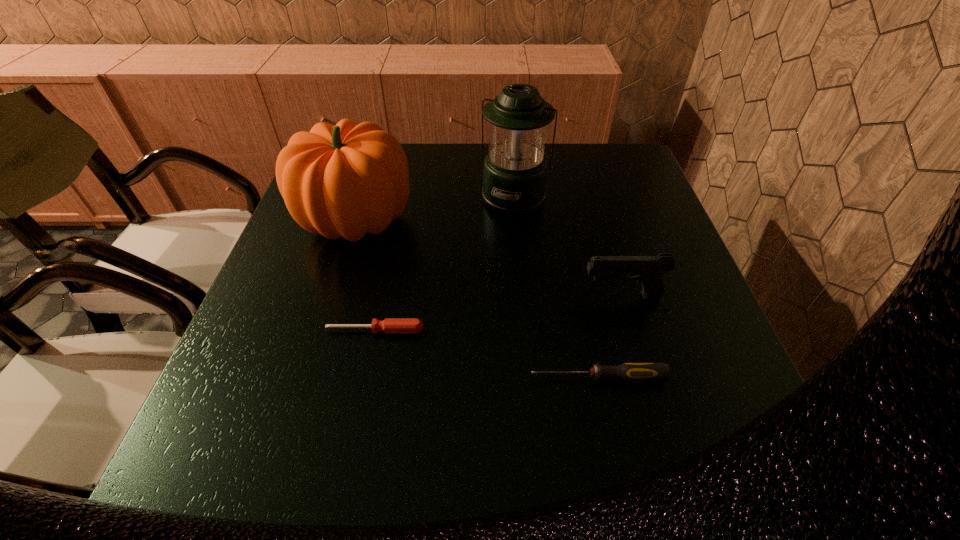
Where is `unoccupied position between the shorter screwdriver and the lantern`? unoccupied position between the shorter screwdriver and the lantern is located at coordinates (444, 264).

At what (x,y) coordinates should I click in order to perform the action: click on free spot between the third tallest object and the lantern. Please return your answer as a coordinate pair (x, y). Looking at the image, I should click on (568, 246).

Where is `vacant area that lies between the pumpkin and the third nearest object`? vacant area that lies between the pumpkin and the third nearest object is located at coordinates (490, 259).

Where is `free area in between the fourth tallest object and the third farthest object`? This screenshot has width=960, height=540. free area in between the fourth tallest object and the third farthest object is located at coordinates (610, 336).

Locate an element on the screen. The image size is (960, 540). vacant point located between the lantern and the pumpkin is located at coordinates (436, 210).

The width and height of the screenshot is (960, 540). In order to click on vacant region between the third farthest object and the pumpkin in this screenshot , I will do `click(490, 259)`.

Find the location of a particular element. The image size is (960, 540). vacant region between the lantern and the right screwdriver is located at coordinates (556, 287).

Locate an element on the screen. The width and height of the screenshot is (960, 540). free space between the lantern and the third nearest object is located at coordinates (568, 246).

The height and width of the screenshot is (540, 960). I want to click on unoccupied area between the farther screwdriver and the nearest object, so click(x=487, y=354).

Locate an element on the screen. vacant area that lies between the nearest object and the shorter screwdriver is located at coordinates (487, 354).